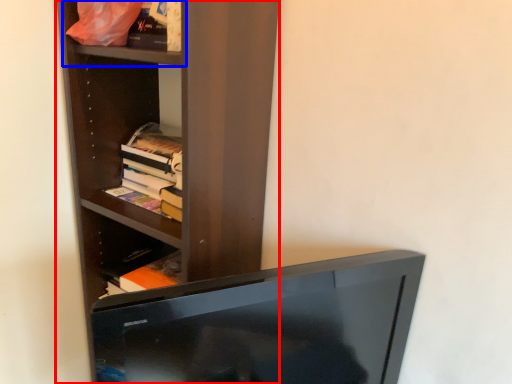
Question: Which object appears farthest to the camera in this image, shelf (highlighted by a red box) or cabinet (highlighted by a blue box)?

Choices:
 (A) shelf
 (B) cabinet

Answer: (B)